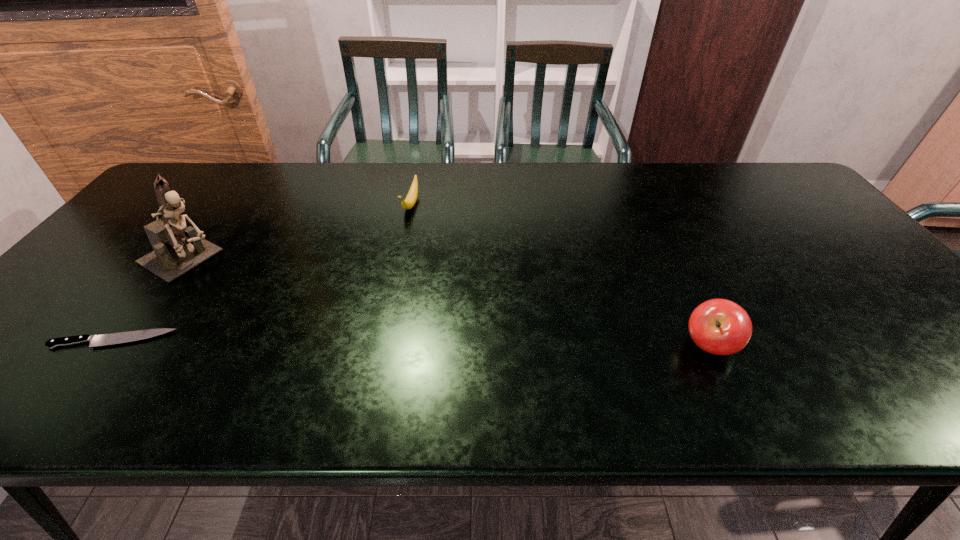
I want to click on steak knife located at the left edge, so click(114, 338).

The height and width of the screenshot is (540, 960). What are the coordinates of `figurine at the left edge` in the screenshot? It's located at (178, 249).

Where is `object present at the near left corner`? The image size is (960, 540). object present at the near left corner is located at coordinates (114, 338).

The width and height of the screenshot is (960, 540). In order to click on free space at the far edge of the desktop in this screenshot , I will do `click(333, 181)`.

The image size is (960, 540). I want to click on free location at the near edge of the desktop, so click(464, 360).

In order to click on free space at the left edge in this screenshot , I will do `click(47, 307)`.

Where is `vacant area at the far right corner of the desktop`? This screenshot has width=960, height=540. vacant area at the far right corner of the desktop is located at coordinates (744, 177).

This screenshot has height=540, width=960. In order to click on free space between the shortest object and the third shortest object in this screenshot , I will do `click(412, 343)`.

The height and width of the screenshot is (540, 960). Find the location of `vacant area between the farthest object and the apple`. vacant area between the farthest object and the apple is located at coordinates (561, 275).

The height and width of the screenshot is (540, 960). What are the coordinates of `free space that is in between the shortest object and the tallest object` in the screenshot? It's located at pos(151,299).